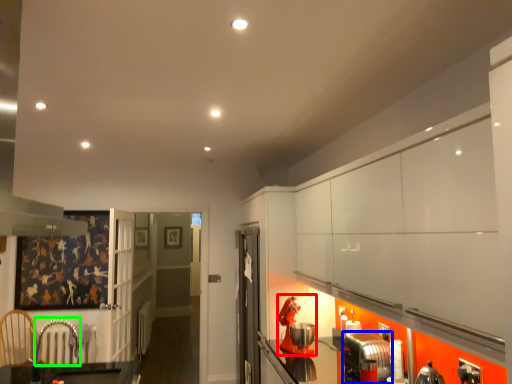
Question: Considering the real-world distances, which object is closest to appliance (highlighted by a red box)? appliance (highlighted by a blue box) or armchair (highlighted by a green box).

Choices:
 (A) appliance
 (B) armchair

Answer: (A)